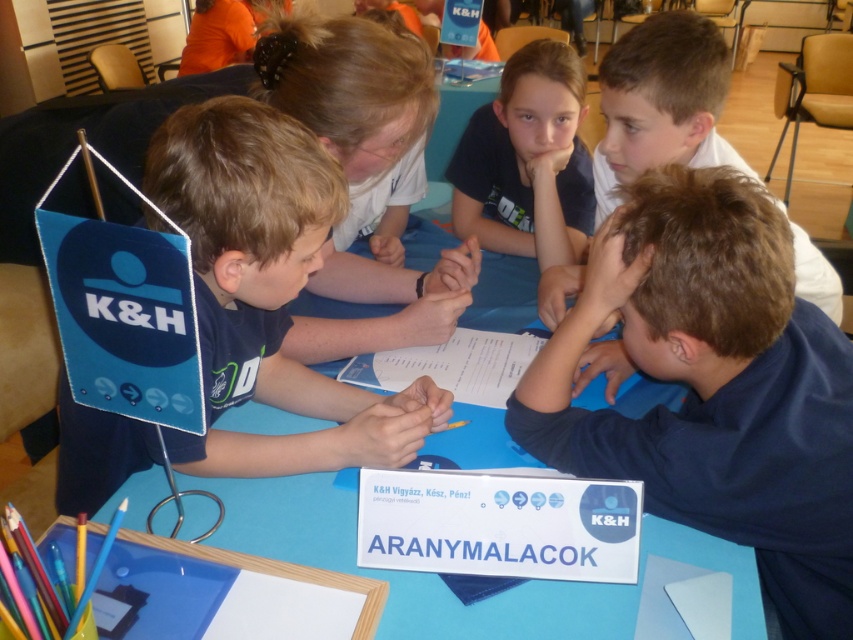
Who is positioned more to the left, matte blue sign at left or dark blue t-shirt at upper center?

matte blue sign at left

Can you confirm if matte blue sign at left is shorter than dark blue t-shirt at upper center?

Incorrect, matte blue sign at left's height does not fall short of dark blue t-shirt at upper center's.

What do you see at coordinates (267, 291) in the screenshot?
I see `matte blue sign at left` at bounding box center [267, 291].

Find the location of a particular element. This screenshot has height=640, width=853. matte blue sign at left is located at coordinates (267, 291).

Who is lower down, dark blue shirt at lower right or matte blue sign at left?

dark blue shirt at lower right is below.

Does point (732, 472) come farther from viewer compared to point (403, 435)?

That is False.

Between point (689, 186) and point (282, 202), which one is positioned in front?

Point (282, 202)

You are a GUI agent. You are given a task and a screenshot of the screen. Output one action in this format:
    pyautogui.click(x=<x>, y=<y>)
    Task: Click on the dark blue shirt at lower right
    The width and height of the screenshot is (853, 640).
    Given the screenshot: What is the action you would take?
    pyautogui.click(x=714, y=387)

This screenshot has height=640, width=853. Describe the element at coordinates (267, 291) in the screenshot. I see `matte blue sign at left` at that location.

Between point (277, 161) and point (604, 611), which one is positioned behind?

Positioned behind is point (604, 611).

You are a GUI agent. You are given a task and a screenshot of the screen. Output one action in this format:
    pyautogui.click(x=<x>, y=<y>)
    Task: Click on the matte blue sign at left
    This screenshot has height=640, width=853.
    Given the screenshot: What is the action you would take?
    pyautogui.click(x=267, y=291)